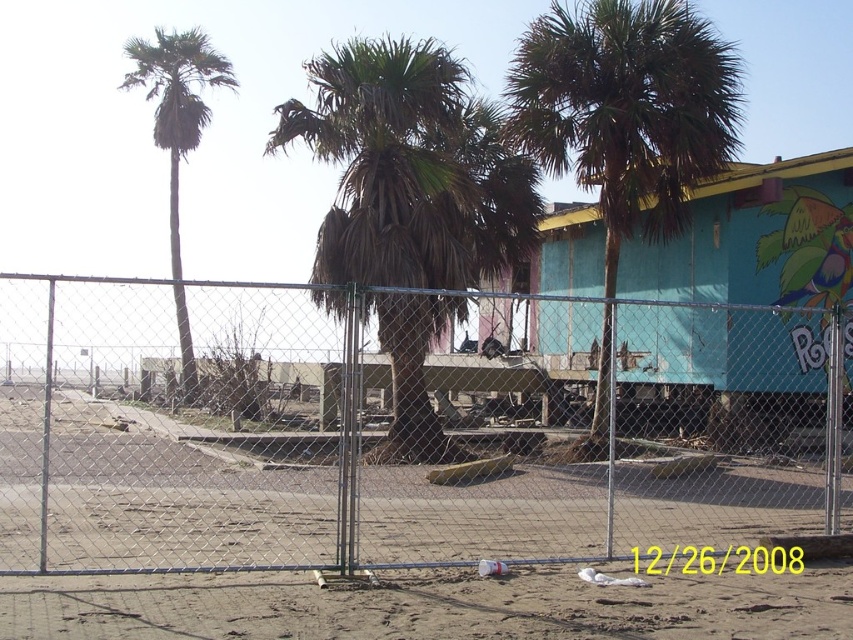
Question: Among these points, which one is farthest from the camera?

Choices:
 (A) (439, 500)
 (B) (178, 316)
 (C) (704, 243)
 (D) (607, 212)

Answer: (B)

Question: Is brown textured palm tree at center bigger than green leafy palm tree at center?

Choices:
 (A) no
 (B) yes

Answer: (B)

Question: Which object is farther from the camera taking this photo?

Choices:
 (A) green leafy palm tree at left
 (B) brown textured palm tree at center
 (C) metal chain-link fence at center

Answer: (B)

Question: Is brown textured palm tree at center below green leafy palm tree at center?

Choices:
 (A) yes
 (B) no

Answer: (A)

Question: Does brown textured palm tree at center appear over green leafy palm tree at left?

Choices:
 (A) yes
 (B) no

Answer: (B)

Question: Which object appears farthest from the camera in this image?

Choices:
 (A) green leafy palm tree at center
 (B) metal chain-link fence at center
 (C) teal painted wood cabin at center

Answer: (C)